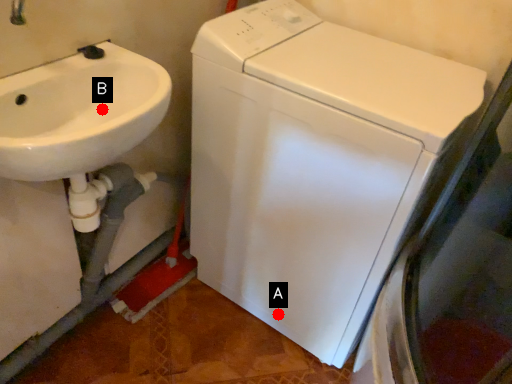
Question: Two points are circled on the image, labeled by A and B beside each circle. Among these points, which one is farthest from the camera?

Choices:
 (A) A is further
 (B) B is further

Answer: (A)